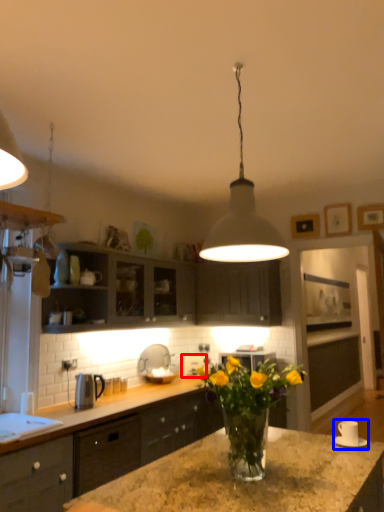
Question: Which object appears farthest to the camera in this image, appliance (highlighted by a red box) or appliance (highlighted by a blue box)?

Choices:
 (A) appliance
 (B) appliance

Answer: (A)